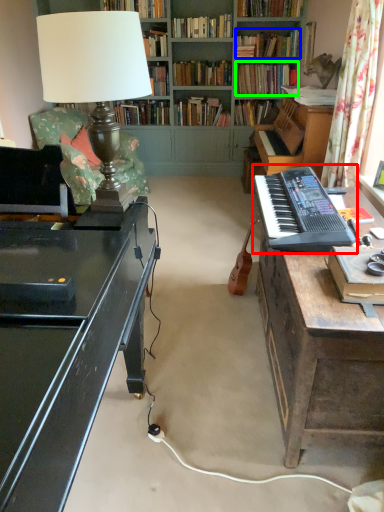
Question: Which object is positioned farthest from musical keyboard (highlighted by a red box)? Select from book (highlighted by a blue box) and book (highlighted by a green box).

Choices:
 (A) book
 (B) book

Answer: (A)